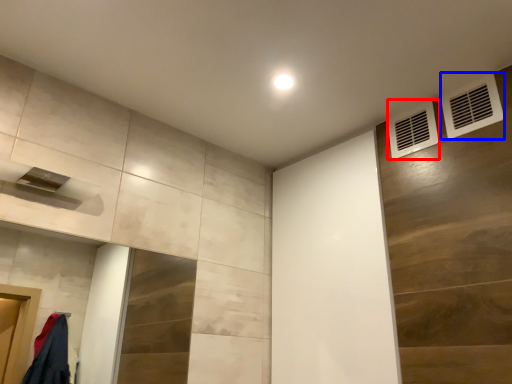
Question: Which point is further to the camera, air conditioning (highlighted by a red box) or air conditioning (highlighted by a blue box)?

Choices:
 (A) air conditioning
 (B) air conditioning

Answer: (A)